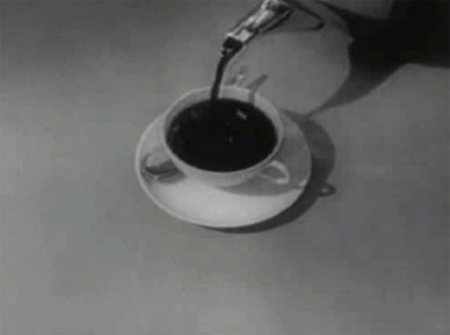
I want to click on handle, so click(284, 166).